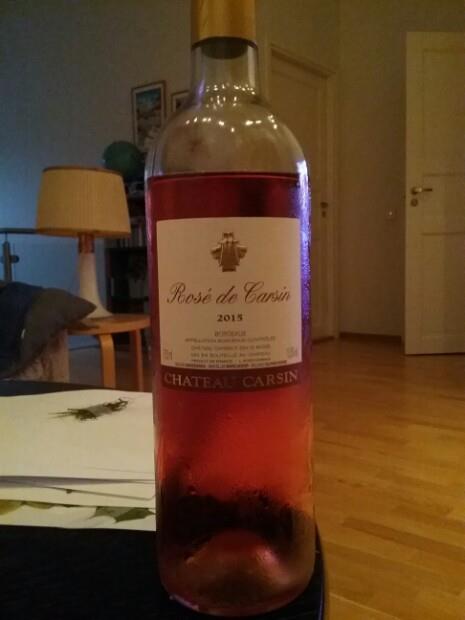
Find the location of a particular element. The width and height of the screenshot is (465, 620). door lock is located at coordinates (414, 201).